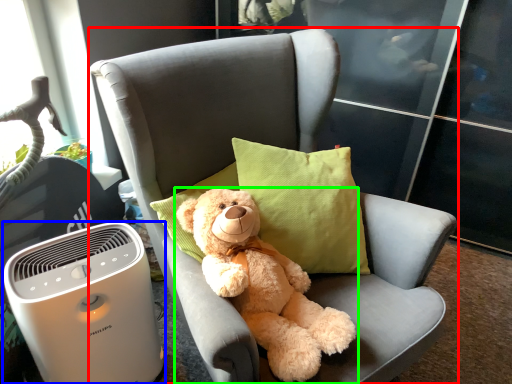
Question: Estimate the real-world distances between objects in this image. Which object is closer to chair (highlighted by a red box), home appliance (highlighted by a blue box) or teddy bear (highlighted by a green box)?

Choices:
 (A) home appliance
 (B) teddy bear

Answer: (B)